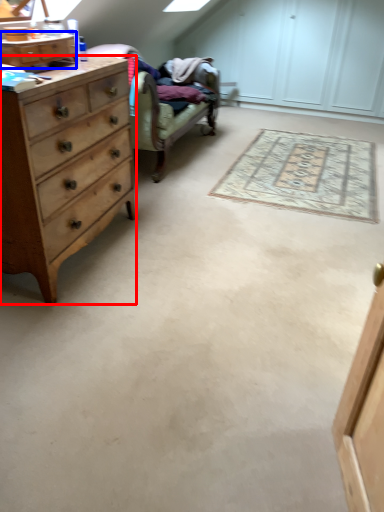
Question: Which point is further to the camera, chest of drawers (highlighted by a red box) or cabinetry (highlighted by a blue box)?

Choices:
 (A) chest of drawers
 (B) cabinetry

Answer: (B)